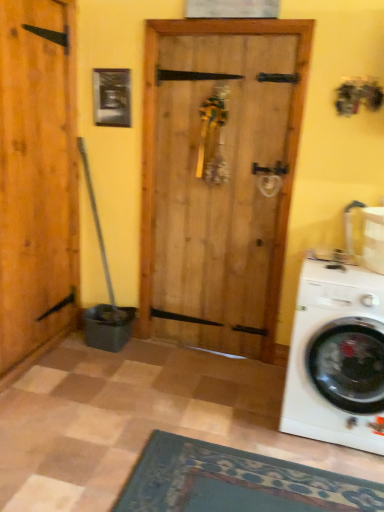
Question: Should I look upward or downward to see white glossy washing machine at lower right?

Choices:
 (A) down
 (B) up

Answer: (A)